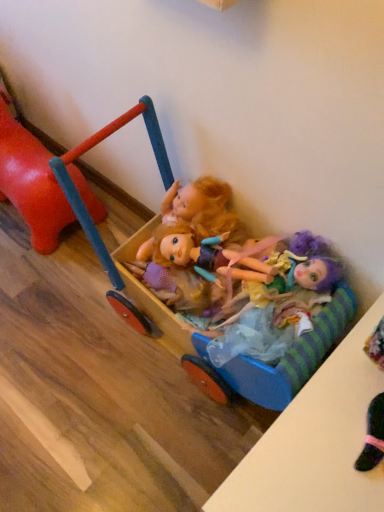
Where is `free spot in front of rubberized red horse at left, the first toy viewed from the left`? free spot in front of rubberized red horse at left, the first toy viewed from the left is located at coordinates (43, 300).